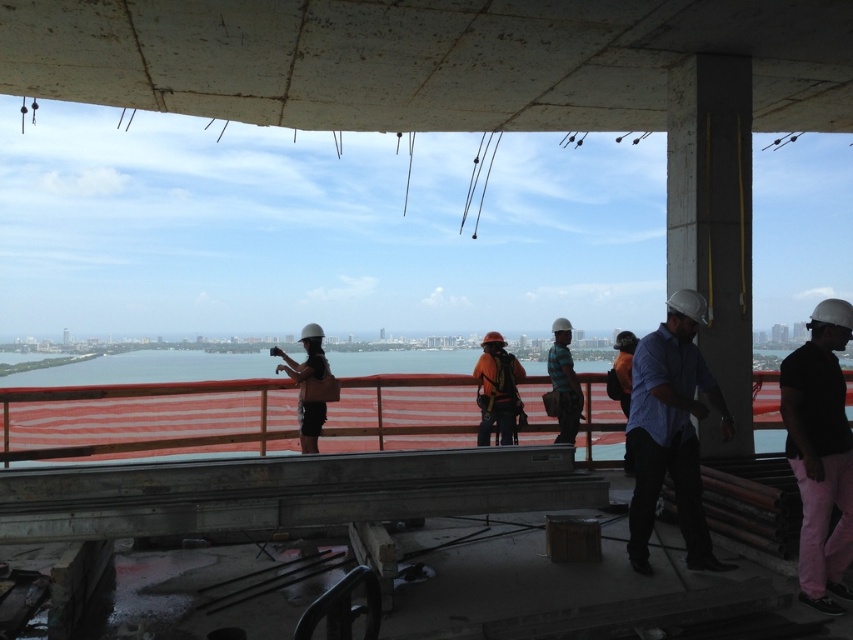
Question: Is matte black helmet at center wider than blue plaid shirt at center?

Choices:
 (A) no
 (B) yes

Answer: (B)

Question: Is blue shirt at right below black matte helmet at right?

Choices:
 (A) no
 (B) yes

Answer: (A)

Question: Does matte black helmet at center appear on the left side of blue plaid shirt at center?

Choices:
 (A) no
 (B) yes

Answer: (B)

Question: Which object is positioned closest to the black matte helmet at right?

Choices:
 (A) blue plaid shirt at center
 (B) matte black helmet at center
 (C) blue shirt at right
 (D) red plastic rail at center

Answer: (C)

Question: Among these objects, which one is farthest from the camera?

Choices:
 (A) blue shirt at right
 (B) matte black helmet at center
 (C) black matte helmet at right

Answer: (B)

Question: Which point appears farthest from the camera in this image?

Choices:
 (A) (556, 385)
 (B) (352, 394)
 (C) (335, 385)

Answer: (B)